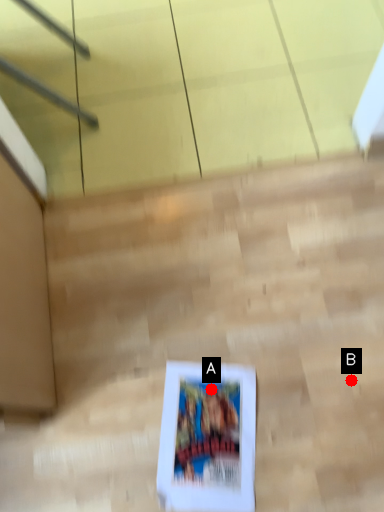
Question: Two points are circled on the image, labeled by A and B beside each circle. Which point is further to the camera?

Choices:
 (A) A is further
 (B) B is further

Answer: (A)